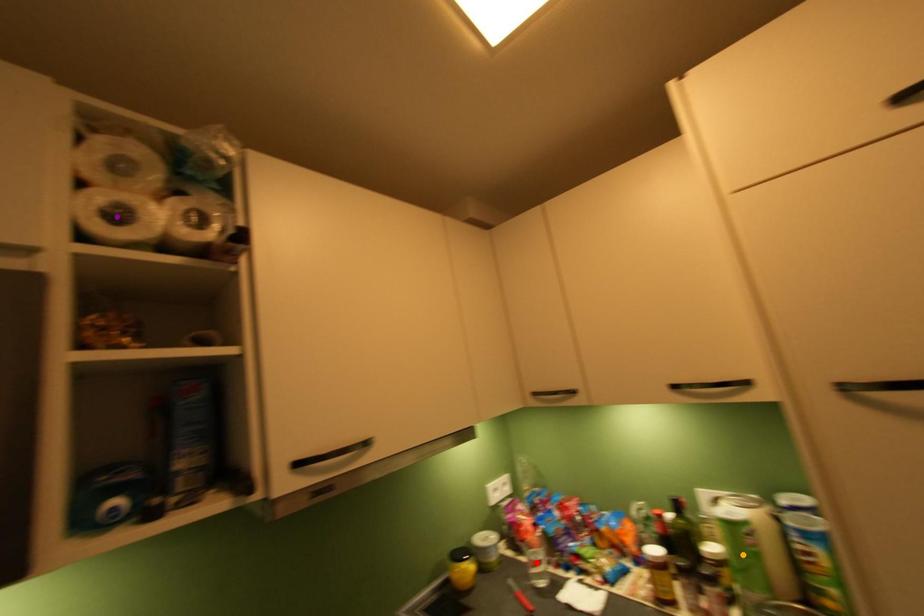
Order these from nearest to farthest:
1. orange point
2. red point
3. purple point

purple point → orange point → red point